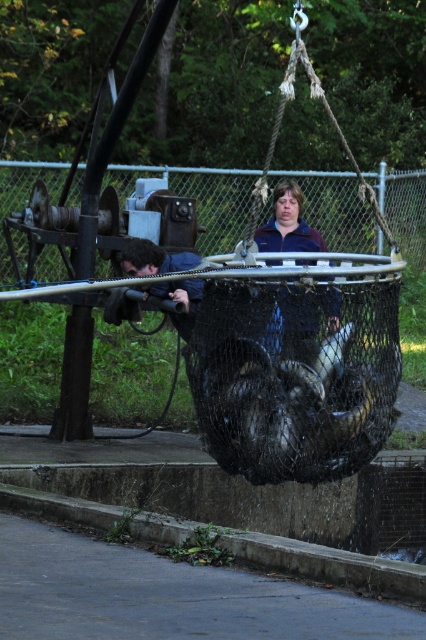
Question: Which of the following is the farthest from the observer?

Choices:
 (A) purple fleece jacket at center
 (B) blue fabric jacket at center

Answer: (A)

Question: Which of these objects is positioned closest to the concrete at lower left?

Choices:
 (A) blue fabric jacket at center
 (B) purple fleece jacket at center

Answer: (A)

Question: Which point is farther to the camera?

Choices:
 (A) (181, 300)
 (B) (294, 337)
 (C) (301, 561)

Answer: (A)

Question: Is purple fleece jacket at center to the right of blue fabric jacket at center from the viewer's perspective?

Choices:
 (A) no
 (B) yes

Answer: (B)

Question: Is concrete at lower left thinner than blue fabric jacket at center?

Choices:
 (A) yes
 (B) no

Answer: (B)

Question: Is concrete at lower left positioned behind blue fabric jacket at center?

Choices:
 (A) yes
 (B) no

Answer: (B)